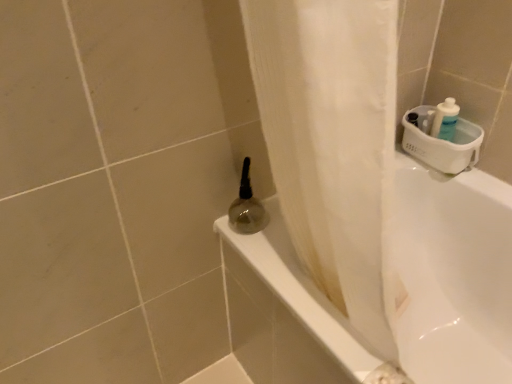
Question: Considering the positions of point (409, 289) and point (233, 211), is point (409, 289) closer or farther from the camera than point (233, 211)?

Choices:
 (A) closer
 (B) farther

Answer: (B)

Question: Is white glossy bathtub at lower right inside the boundaries of translucent glass bottle at upper center, or outside?

Choices:
 (A) outside
 (B) inside

Answer: (A)

Question: From a real-world perspective, relative to translucent glass bottle at upper center, is white glossy bathtub at lower right vertically above or below?

Choices:
 (A) below
 (B) above

Answer: (A)

Question: From the image's perspective, is translucent glass bottle at upper center positioned above or below white glossy bathtub at lower right?

Choices:
 (A) above
 (B) below

Answer: (A)

Question: Is translucent glass bottle at upper center in front of or behind white glossy bathtub at lower right in the image?

Choices:
 (A) behind
 (B) front

Answer: (A)

Question: In terms of size, does translucent glass bottle at upper center appear bigger or smaller than white glossy bathtub at lower right?

Choices:
 (A) small
 (B) big

Answer: (A)

Question: Looking at their shapes, would you say translucent glass bottle at upper center is wider or thinner than white glossy bathtub at lower right?

Choices:
 (A) wide
 (B) thin

Answer: (B)